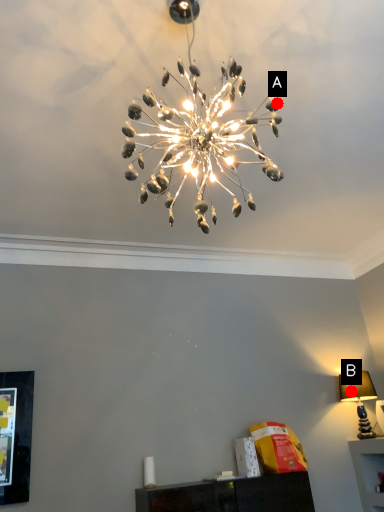
Question: Two points are circled on the image, labeled by A and B beside each circle. Which point appears closest to the camera in this image?

Choices:
 (A) A is closer
 (B) B is closer

Answer: (A)